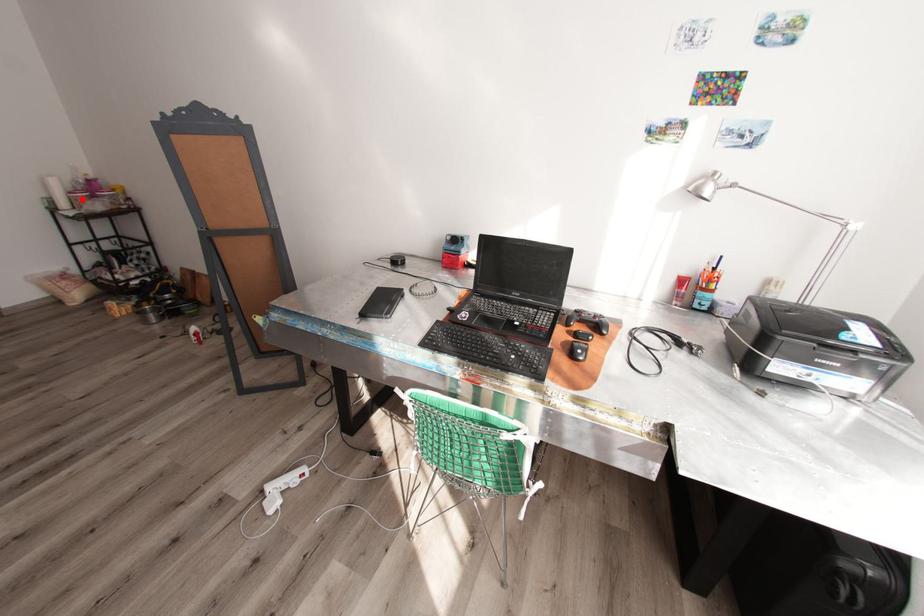
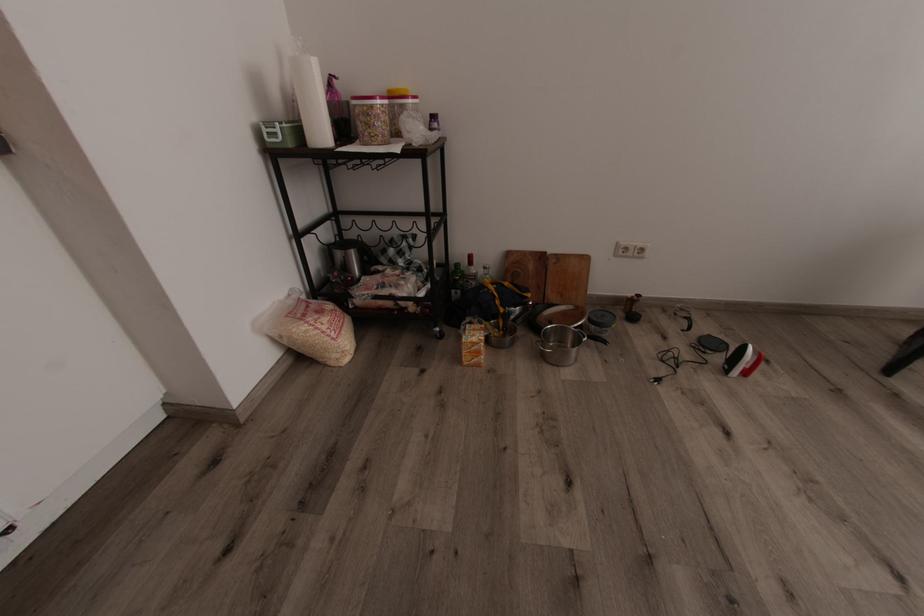
Question: I am providing you with two images of the same scene from different viewpoints. A red point is marked on the first image. At the location where the point appears in image 1, is it still visible in image 2?

Choices:
 (A) Yes
 (B) No

Answer: (A)